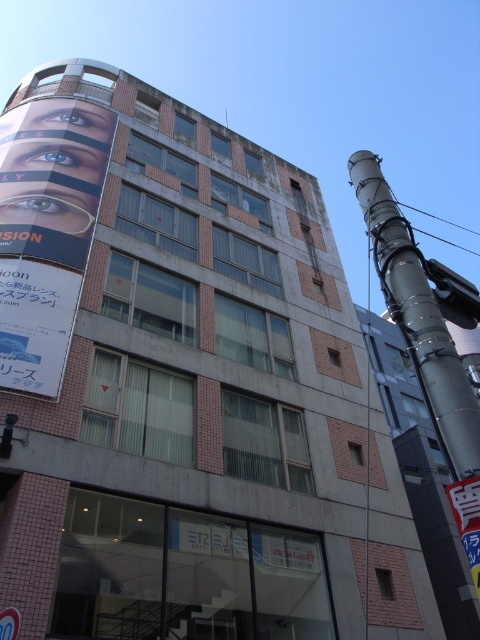
You are standing at the entrance of the building and looking towards the large advertisement banner on the left. There is a point marked at coordinates (420,320). Based on the scene description, what object is located at that point?

The point at (420,320) corresponds to the metallic gray pole at right.

You are a delivery person approaching the building and need to locate the delivery entrance. The delivery entrance has a sign. Which object should you look for first, the metallic gray pole at right or the white plastic sign at center?

The white plastic sign at center should be looked for first since the metallic gray pole at right is located above it, meaning the sign is lower and more visible at ground level.

You are standing in front of the building and want to take a photo that includes both the point at location (40, 237) and the point at (8, 628). Based on their positions, which point should you focus on first to ensure both are in focus?

You should focus on the point at (40, 237) first because it is closer to the camera than the point at (8, 628). This ensures that both points will be within the depth of field when focused on the closer object.